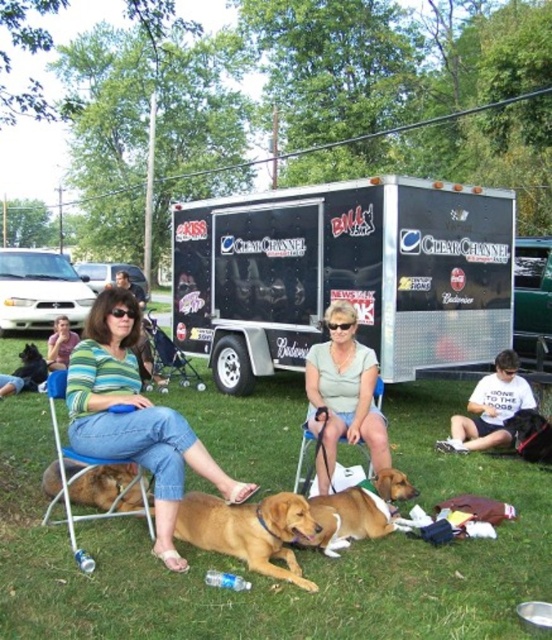
Question: Is brown furry dog at center above golden brown fur at lower left?

Choices:
 (A) no
 (B) yes

Answer: (A)

Question: Does striped knit sweater at center have a smaller size compared to blue plastic folding chair at lower left?

Choices:
 (A) yes
 (B) no

Answer: (B)

Question: Which of the following is the closest to the observer?

Choices:
 (A) black glossy dog at lower right
 (B) striped knit sweater at center
 (C) blue plastic folding chair at lower left

Answer: (C)

Question: Which point appears farthest from the camera in this image?

Choices:
 (A) (468, 410)
 (B) (342, 321)
 (C) (31, 376)

Answer: (C)

Question: Estimate the real-world distances between objects in this image. Which object is closer to the golden brown fur at center?

Choices:
 (A) green grass at lower center
 (B) black fur dog at lower left
 (C) black metallic trailer at center
 (D) brown furry dog at center

Answer: (D)

Question: Observing the image, what is the correct spatial positioning of green grass at lower center in reference to blue plastic folding chair at lower left?

Choices:
 (A) below
 (B) above

Answer: (A)